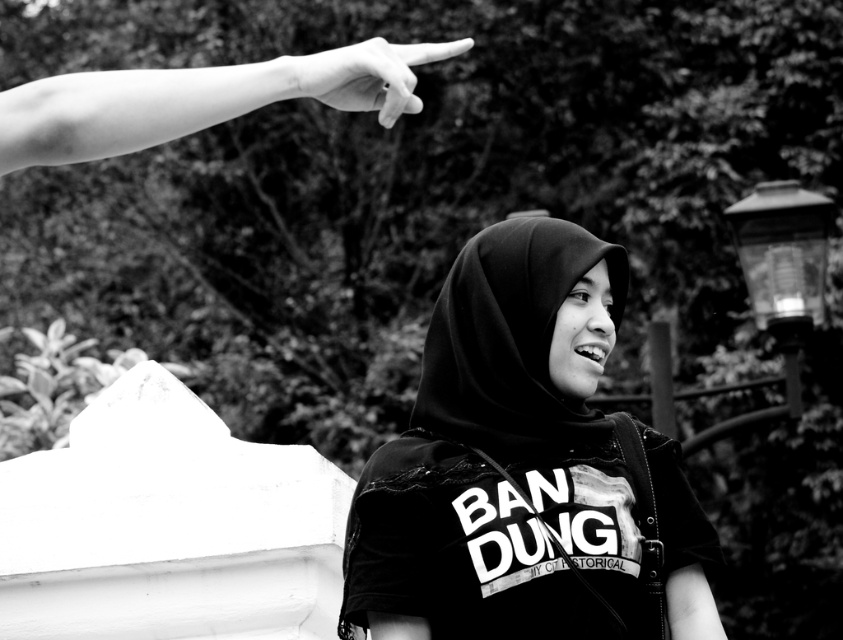
Is point (460, 480) closer to camera compared to point (133, 70)?

Yes, it is in front of point (133, 70).

Who is more forward, (454, 324) or (464, 42)?

Positioned in front is point (464, 42).

Find the location of a particular element. The image size is (843, 640). black matte hijab at center is located at coordinates (522, 467).

Does point (497, 280) come farther from viewer compared to point (337, 76)?

Yes, point (497, 280) is farther from viewer.

The height and width of the screenshot is (640, 843). What do you see at coordinates (522, 467) in the screenshot?
I see `black matte hijab at center` at bounding box center [522, 467].

Which is in front, point (468, 528) or point (313, 83)?

Point (313, 83) is in front.

This screenshot has height=640, width=843. What are the coordinates of `black matte hijab at center` in the screenshot? It's located at (522, 467).

Who is taller, smooth skin hand at upper left or smooth skin finger at upper left?

Standing taller between the two is smooth skin hand at upper left.

Which of these two, smooth skin hand at upper left or smooth skin finger at upper left, stands shorter?

Standing shorter between the two is smooth skin finger at upper left.

Which is in front, point (63, 122) or point (409, 56)?

Point (63, 122)

Where is `smooth skin hand at upper left`? This screenshot has height=640, width=843. smooth skin hand at upper left is located at coordinates (199, 99).